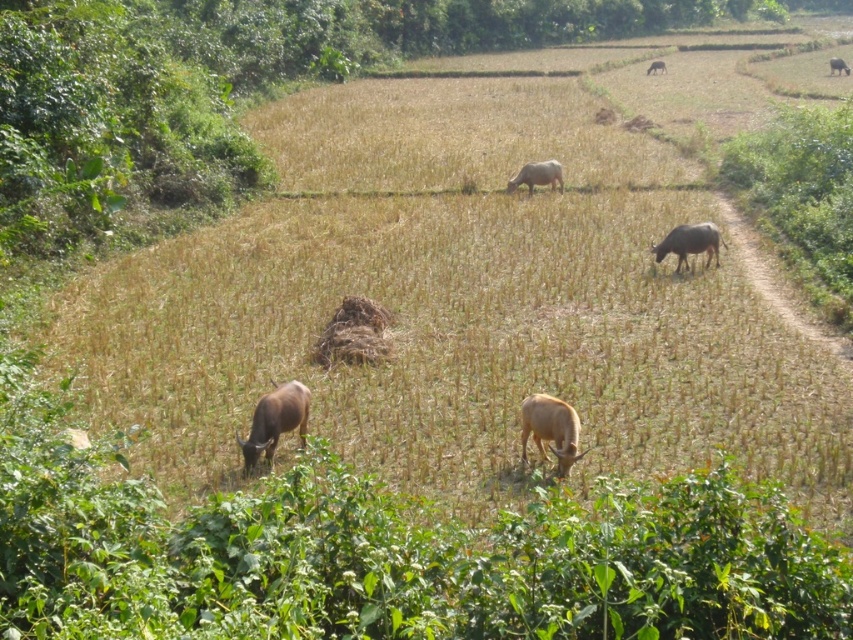
Question: Does brown matte cow at center-right have a lesser width compared to brown matte cow at upper center?

Choices:
 (A) no
 (B) yes

Answer: (A)

Question: Among these points, which one is nearest to the camera?

Choices:
 (A) pyautogui.click(x=292, y=416)
 (B) pyautogui.click(x=523, y=404)

Answer: (B)

Question: Estimate the real-world distances between objects in this image. Which object is farther from the brown matte cow at lower left?

Choices:
 (A) brown matte cow at upper right
 (B) brown matte cow at center-right
 (C) brown matte cow at upper center
 (D) white matte cow at center

Answer: (A)

Question: Which object appears closest to the camera in this image?

Choices:
 (A) brown matte cow at lower left
 (B) brown matte cow at center

Answer: (B)

Question: Can you confirm if brown matte cow at center is thinner than white matte cow at center?

Choices:
 (A) yes
 (B) no

Answer: (A)

Question: Considering the relative positions of brown matte cow at lower left and brown matte cow at center in the image provided, where is brown matte cow at lower left located with respect to brown matte cow at center?

Choices:
 (A) right
 (B) left

Answer: (B)